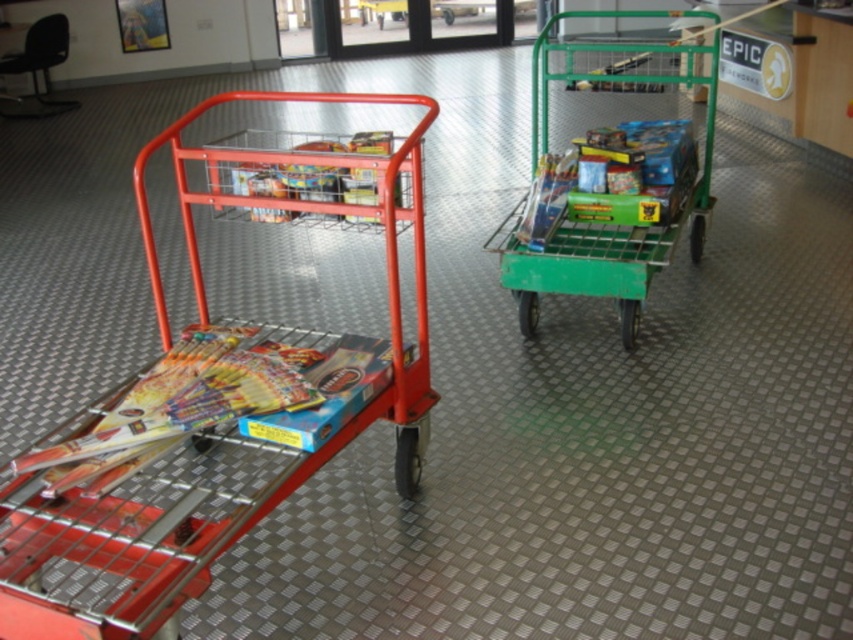
Question: Can you confirm if metallic red shopping cart at left is positioned to the left of green metal trolley at right?

Choices:
 (A) no
 (B) yes

Answer: (B)

Question: Can you confirm if metallic red shopping cart at left is thinner than green metal trolley at right?

Choices:
 (A) no
 (B) yes

Answer: (A)

Question: Which point is closer to the camera taking this photo?

Choices:
 (A) (646, 113)
 (B) (323, 436)

Answer: (B)

Question: Considering the relative positions of metallic red shopping cart at left and green metal trolley at right in the image provided, where is metallic red shopping cart at left located with respect to green metal trolley at right?

Choices:
 (A) below
 (B) above

Answer: (A)

Question: Which point is closer to the camera?

Choices:
 (A) (592, 129)
 (B) (1, 484)

Answer: (B)